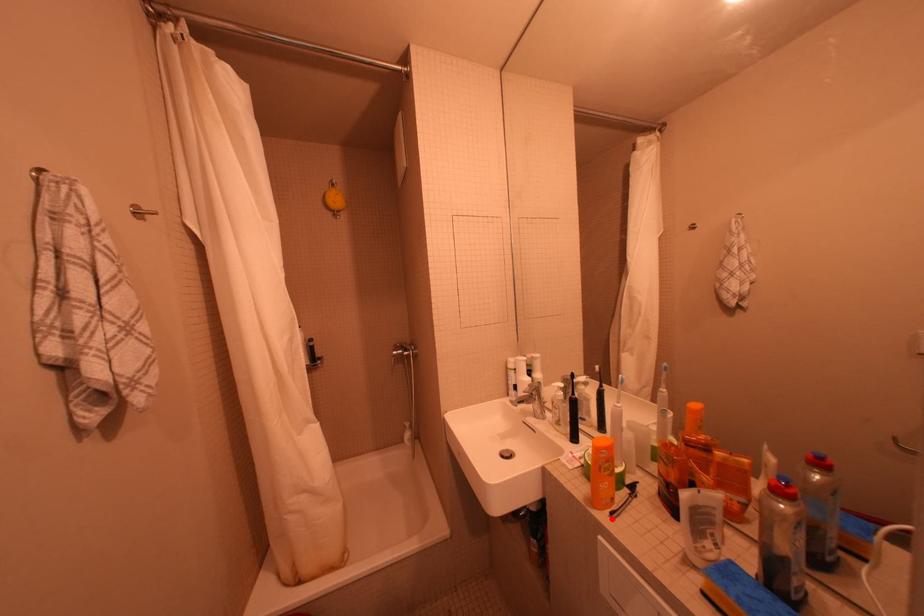
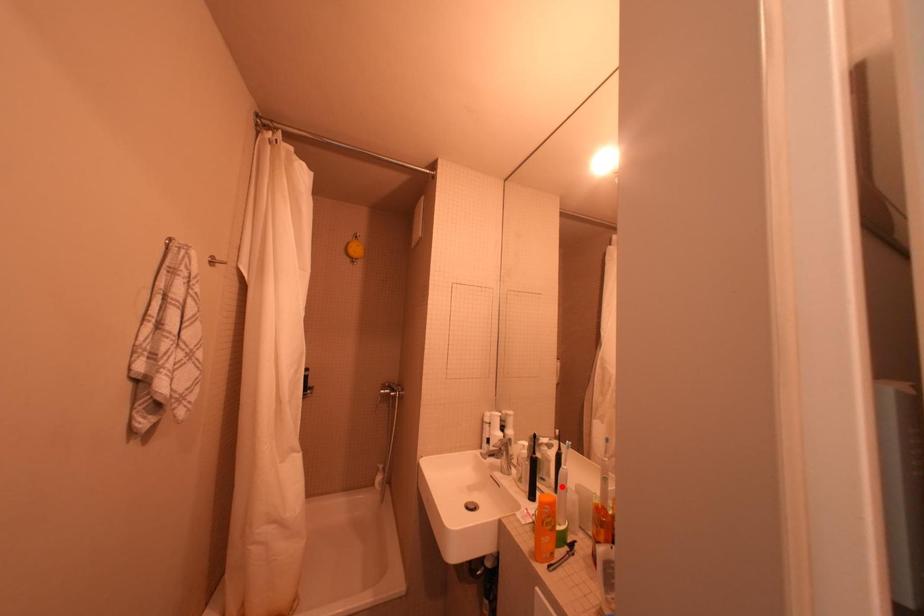
I am providing you with two images of the same scene from different viewpoints. A red point is marked on the first image and another point is marked on the second image. Do the highlighted points in image1 and image2 indicate the same real-world spot?

No